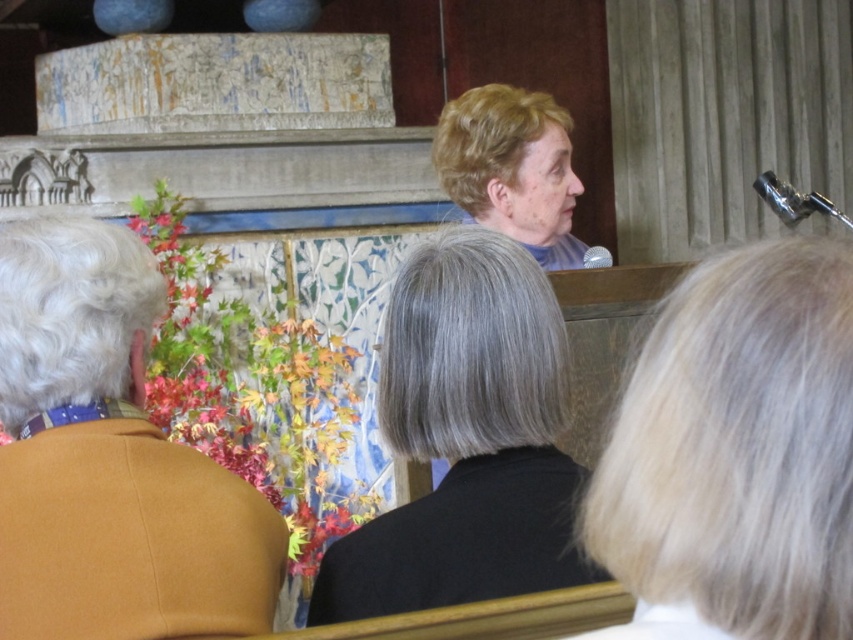
Who is higher up, blonde hair at upper right or orange wool sweater at left?

blonde hair at upper right is above.

Looking at this image, is blonde hair at upper right further to the viewer compared to orange wool sweater at left?

No, it is not.

Between point (740, 360) and point (39, 428), which one is positioned in front?

Point (740, 360) is in front.

Locate an element on the screen. The height and width of the screenshot is (640, 853). blonde hair at upper right is located at coordinates (735, 452).

Is orange wool sweater at left further to camera compared to light brown hair at upper center?

No.

How far apart are orange wool sweater at left and light brown hair at upper center?

They are 1.70 meters apart.

The image size is (853, 640). Find the location of `orange wool sweater at left`. orange wool sweater at left is located at coordinates (109, 460).

Where is `orange wool sweater at left`? The height and width of the screenshot is (640, 853). orange wool sweater at left is located at coordinates (109, 460).

Does blonde hair at upper right have a greater height compared to light brown hair at upper center?

Incorrect, blonde hair at upper right's height is not larger of light brown hair at upper center's.

Between blonde hair at upper right and light brown hair at upper center, which one appears on the right side from the viewer's perspective?

From the viewer's perspective, light brown hair at upper center appears more on the right side.

Is point (772, 380) less distant than point (511, 90)?

That is True.

At what (x,y) coordinates should I click in order to perform the action: click on blonde hair at upper right. Please return your answer as a coordinate pair (x, y). Looking at the image, I should click on point(735,452).